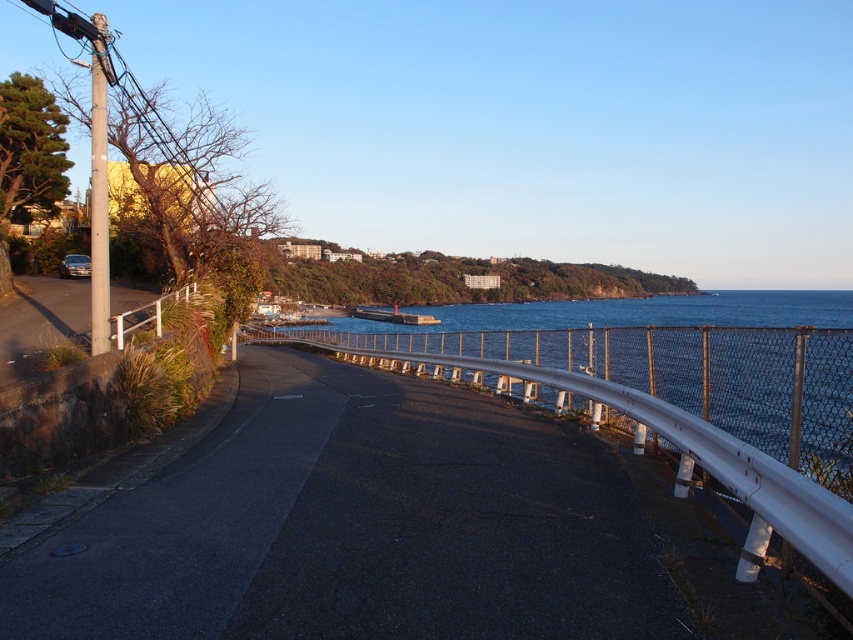
Question: Among these points, which one is nearest to the camera?

Choices:
 (A) (334, 346)
 (B) (361, 419)
 (C) (485, 308)
 (D) (93, 104)

Answer: (D)

Question: Considering the relative positions of black asphalt road at center and smooth gray pole at left in the image provided, where is black asphalt road at center located with respect to smooth gray pole at left?

Choices:
 (A) right
 (B) left

Answer: (A)

Question: Where is black asphalt road at center located in relation to white metallic rail at center-right in the image?

Choices:
 (A) right
 (B) left

Answer: (B)

Question: Among these objects, which one is farthest from the camera?

Choices:
 (A) smooth gray pole at left
 (B) metallic chain-link fence at center

Answer: (A)

Question: Considering the real-world distances, which object is farthest from the black asphalt road at center?

Choices:
 (A) white metallic rail at center-right
 (B) smooth gray pole at left

Answer: (B)

Question: Is black asphalt road at center closer to camera compared to smooth gray pole at left?

Choices:
 (A) no
 (B) yes

Answer: (B)